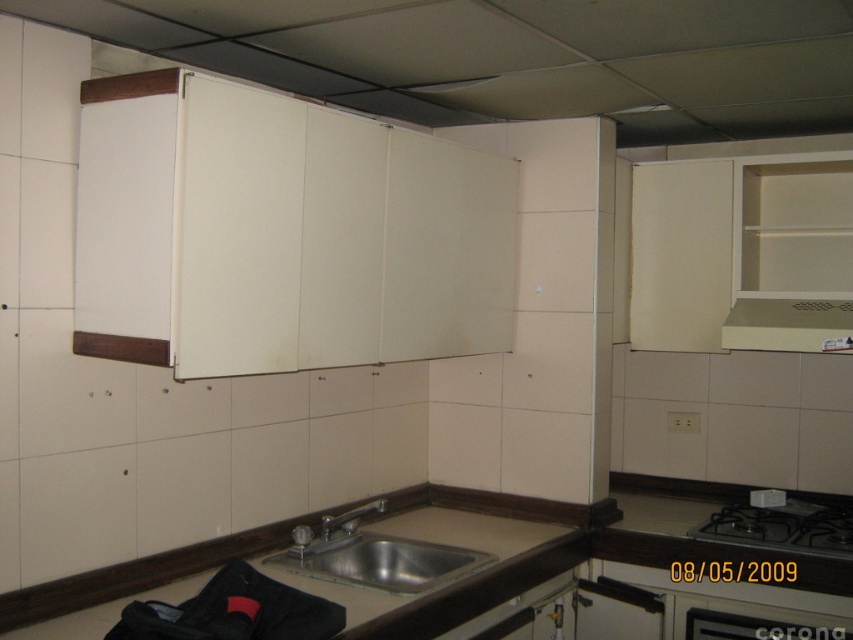
Consider the image. Does stainless steel sink at center appear on the left side of silver metallic faucet at sink center?

In fact, stainless steel sink at center is to the right of silver metallic faucet at sink center.

Is stainless steel sink at center positioned at the back of silver metallic faucet at sink center?

No, it is in front of silver metallic faucet at sink center.

Is point (378, 554) more distant than point (346, 525)?

No, (378, 554) is in front of (346, 525).

Find the location of a particular element. stainless steel sink at center is located at coordinates (374, 556).

In the scene shown: Which is above, brown laminate counter top at lower center or beige matte exhaust hood at upper right?

Positioned higher is beige matte exhaust hood at upper right.

Is brown laminate counter top at lower center shorter than beige matte exhaust hood at upper right?

Yes, brown laminate counter top at lower center is shorter than beige matte exhaust hood at upper right.

At what (x,y) coordinates should I click in order to perform the action: click on brown laminate counter top at lower center. Please return your answer as a coordinate pair (x, y). The image size is (853, 640). Looking at the image, I should click on (613, 532).

Between stainless steel sink at center and beige matte exhaust hood at upper right, which one is positioned lower?

stainless steel sink at center is lower down.

Is stainless steel sink at center behind beige matte exhaust hood at upper right?

No, stainless steel sink at center is in front of beige matte exhaust hood at upper right.

I want to click on stainless steel sink at center, so click(374, 556).

Image resolution: width=853 pixels, height=640 pixels. Identify the location of stainless steel sink at center. click(374, 556).